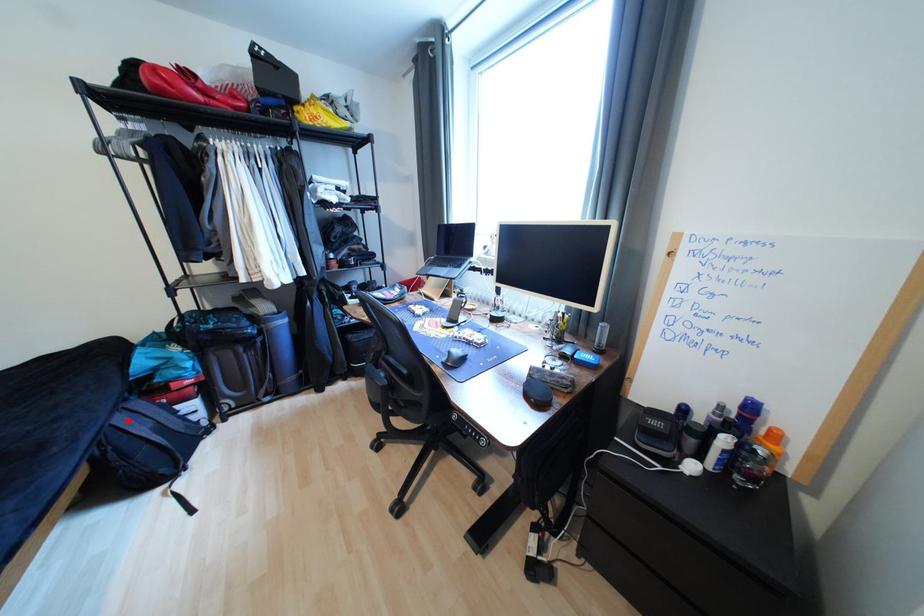
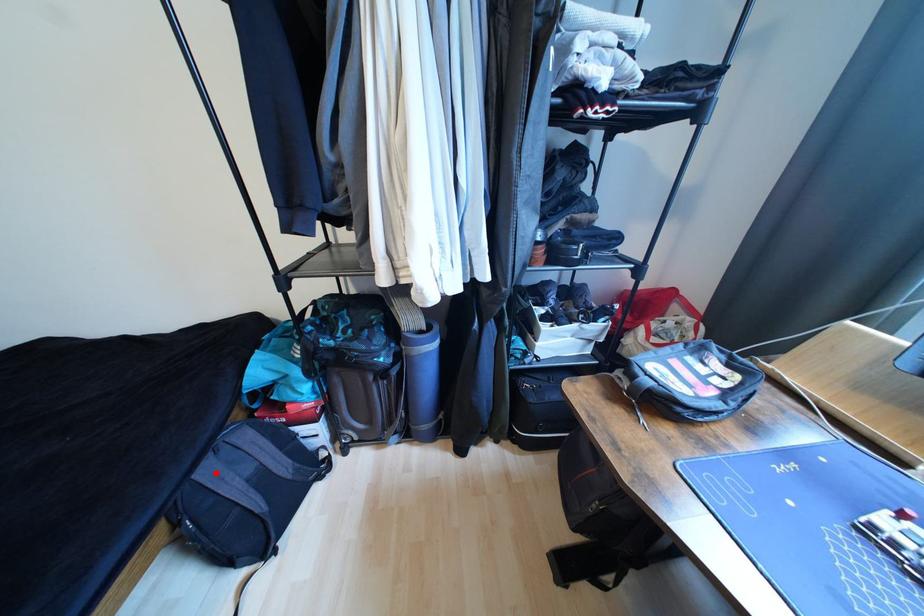
I am providing you with two images of the same scene from different viewpoints. A red point is marked on the first image and another point is marked on the second image. Are the points marked in image1 and image2 representing the same 3D position?

Yes